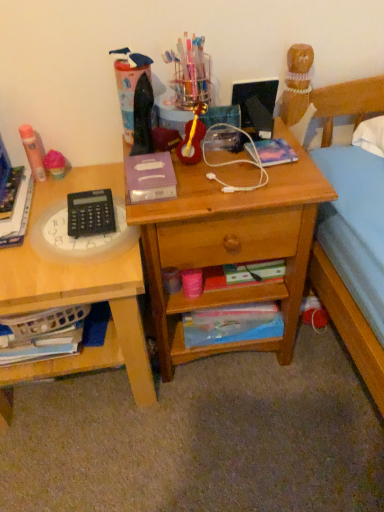
What are the coordinates of `vacant space in between purple matte paperback book at center, the 3th paperback book when ordered from back to front, and white matte earphones at center` in the screenshot? It's located at (188, 180).